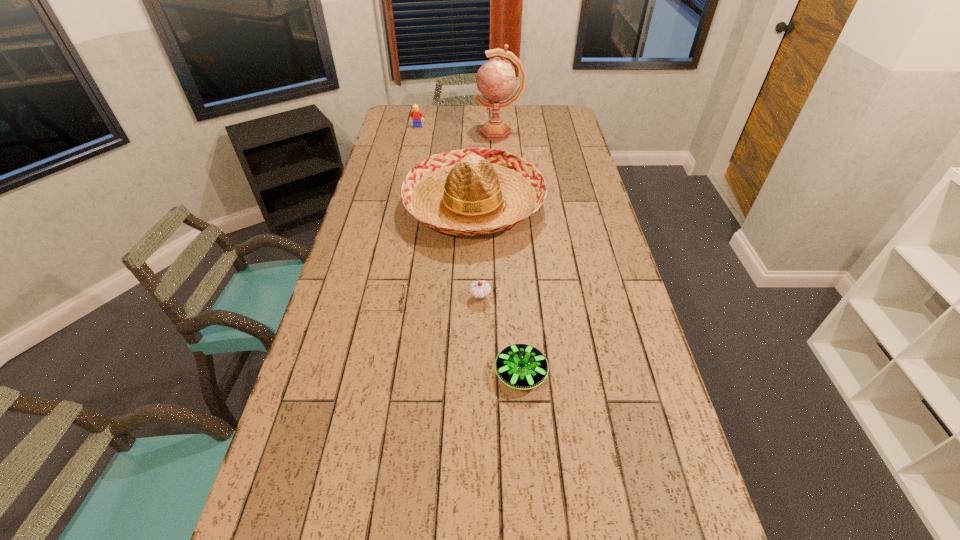
Find the location of a particular element. the tallest object is located at coordinates (496, 81).

I want to click on the third farthest object, so tap(474, 191).

What are the coordinates of `the fifth shortest object` in the screenshot? It's located at (474, 191).

At what (x,y) coordinates should I click in order to perform the action: click on Lego. Please return your answer as a coordinate pair (x, y). Image resolution: width=960 pixels, height=540 pixels. Looking at the image, I should click on (416, 115).

Locate an element on the screen. The image size is (960, 540). cupcake is located at coordinates (479, 289).

Locate an element on the screen. The width and height of the screenshot is (960, 540). the nearest object is located at coordinates (520, 366).

I want to click on saucer, so click(x=520, y=366).

Where is `the shortest object`? the shortest object is located at coordinates (403, 289).

Where is `vacant space located 0.220m on the front-facing side of the tallest object`? Image resolution: width=960 pixels, height=540 pixels. vacant space located 0.220m on the front-facing side of the tallest object is located at coordinates (427, 133).

Where is `vacant space located on the front-facing side of the tallest object`? Image resolution: width=960 pixels, height=540 pixels. vacant space located on the front-facing side of the tallest object is located at coordinates (441, 133).